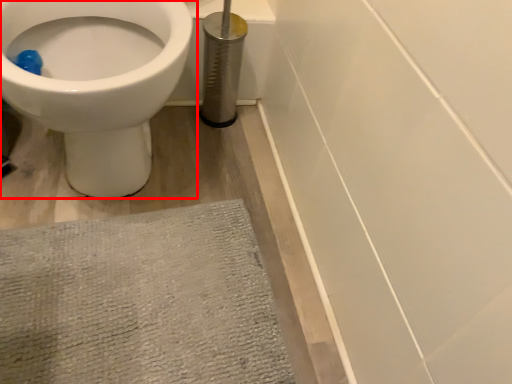
Question: From the image's perspective, what is the correct spatial relationship of toilet (annotated by the red box) in relation to bath mat?

Choices:
 (A) above
 (B) below

Answer: (A)